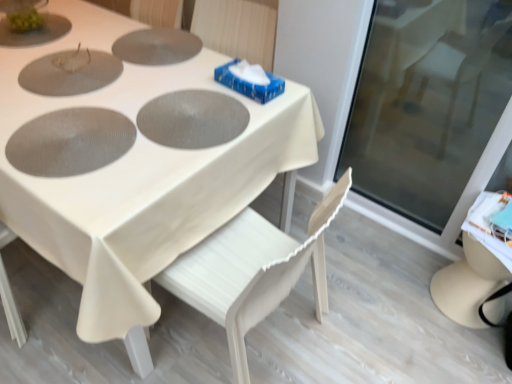
The width and height of the screenshot is (512, 384). Identify the location of vacant area on the back side of matte gray pizza pan at center, which appears as the third pizza pan when viewed from the back. (119, 85).